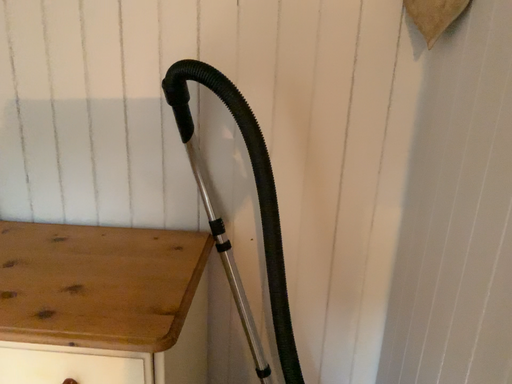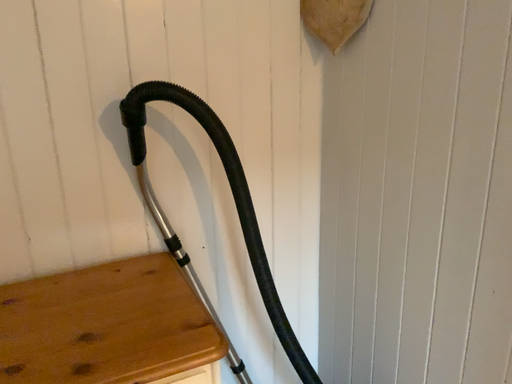
Question: How did the camera likely rotate when shooting the video?

Choices:
 (A) rotated left
 (B) rotated right

Answer: (B)